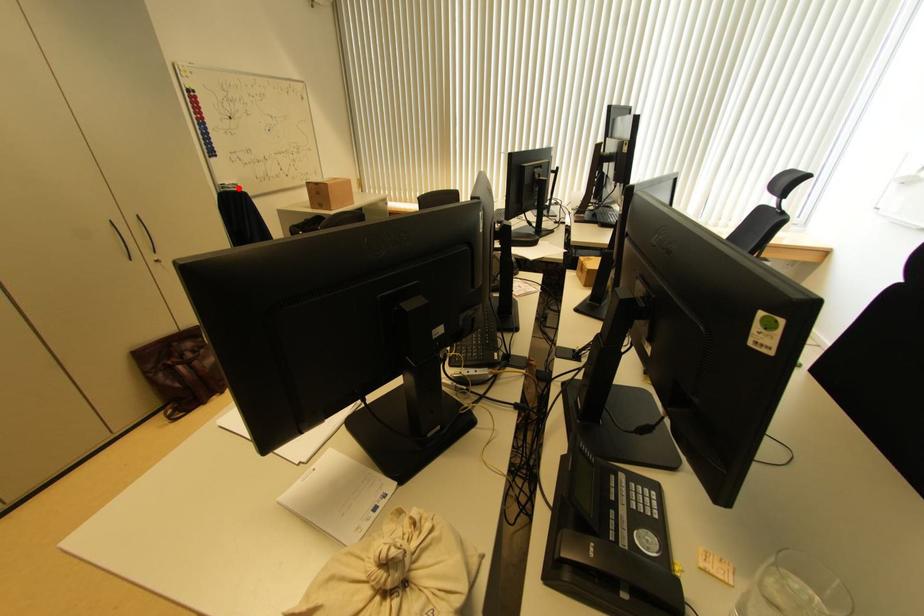
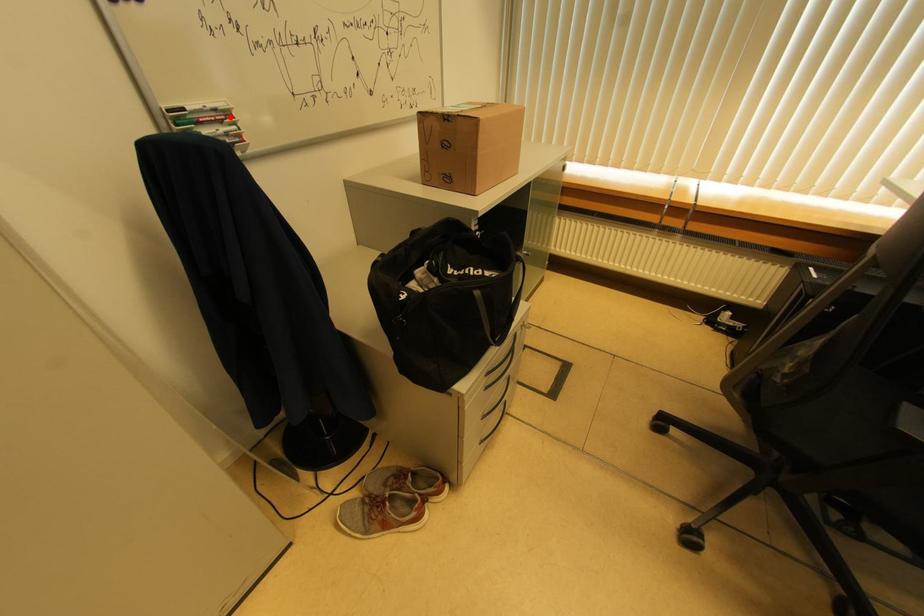
I am providing you with two images of the same scene from different viewpoints. A red point is marked on the first image and another point is marked on the second image. Is the red point in image1 aligned with the point shown in image2?

Yes